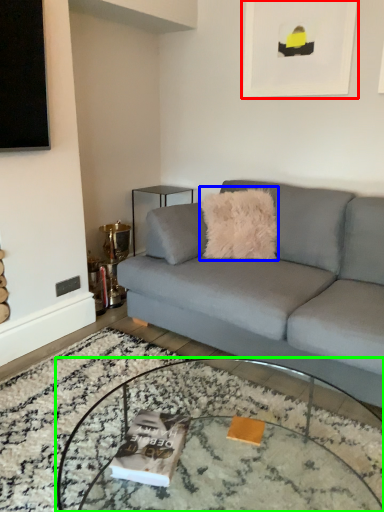
Question: Based on their relative distances, which object is nearer to picture frame (highlighted by a red box)? Choose from throw pillow (highlighted by a blue box) and coffee table (highlighted by a green box).

Choices:
 (A) throw pillow
 (B) coffee table

Answer: (A)